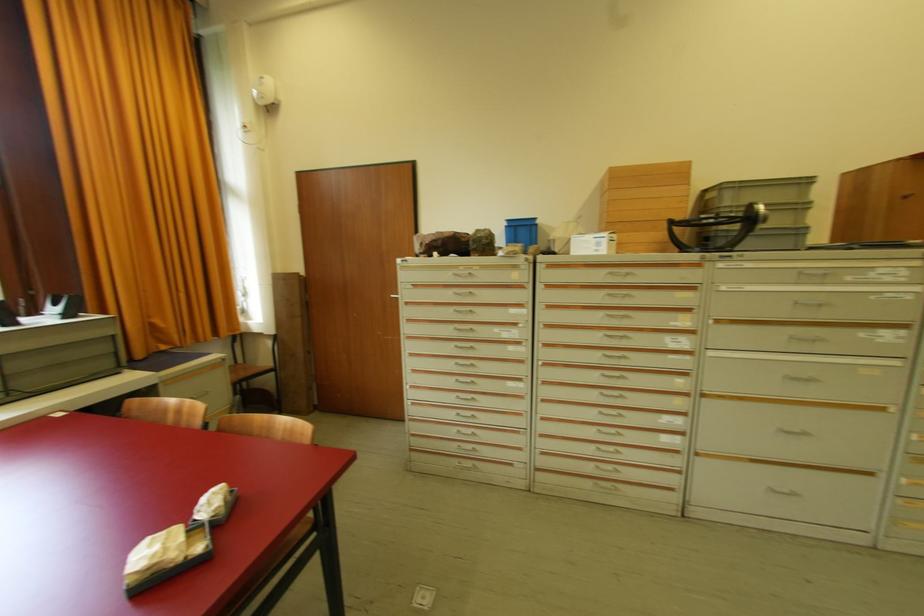
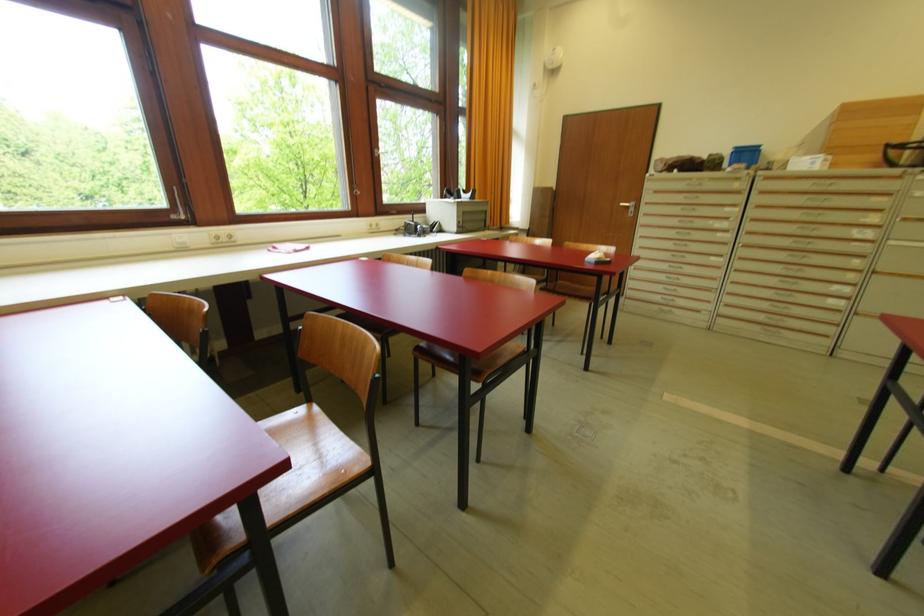
The point at [603,315] is marked in the first image. Where is the corresponding point in the second image?

(804, 214)